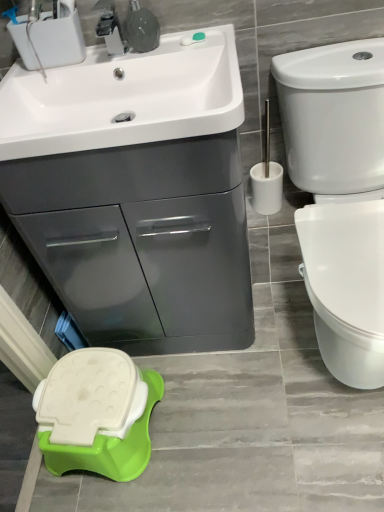
Question: From a real-world perspective, is white plastic toilet brush at right below matte gray cabinet at upper left?

Choices:
 (A) yes
 (B) no

Answer: (B)

Question: Considering the relative sizes of white plastic toilet brush at right and matte gray cabinet at upper left in the image provided, is white plastic toilet brush at right bigger than matte gray cabinet at upper left?

Choices:
 (A) yes
 (B) no

Answer: (B)

Question: Is white plastic toilet brush at right placed right next to matte gray cabinet at upper left?

Choices:
 (A) no
 (B) yes

Answer: (A)

Question: Is the depth of white plastic toilet brush at right less than that of matte gray cabinet at upper left?

Choices:
 (A) yes
 (B) no

Answer: (B)

Question: From the image's perspective, would you say white plastic toilet brush at right is shown under matte gray cabinet at upper left?

Choices:
 (A) no
 (B) yes

Answer: (A)

Question: Could you tell me if white plastic toilet brush at right is facing matte gray cabinet at upper left?

Choices:
 (A) no
 (B) yes

Answer: (A)

Question: Is white plastic toilet brush at right not near white glossy toilet at right?

Choices:
 (A) no
 (B) yes

Answer: (A)

Question: From the image's perspective, would you say white plastic toilet brush at right is shown under white glossy toilet at right?

Choices:
 (A) no
 (B) yes

Answer: (A)

Question: Is white plastic toilet brush at right looking in the opposite direction of white glossy toilet at right?

Choices:
 (A) yes
 (B) no

Answer: (B)

Question: Can you confirm if white plastic toilet brush at right is wider than white glossy toilet at right?

Choices:
 (A) yes
 (B) no

Answer: (B)

Question: Is white plastic toilet brush at right not within white glossy toilet at right?

Choices:
 (A) yes
 (B) no

Answer: (A)

Question: From a real-world perspective, is white plastic toilet brush at right located higher than white glossy toilet at right?

Choices:
 (A) no
 (B) yes

Answer: (B)

Question: Considering the relative positions of white glossy toilet at right and white glossy sink at upper left in the image provided, is white glossy toilet at right behind white glossy sink at upper left?

Choices:
 (A) yes
 (B) no

Answer: (B)